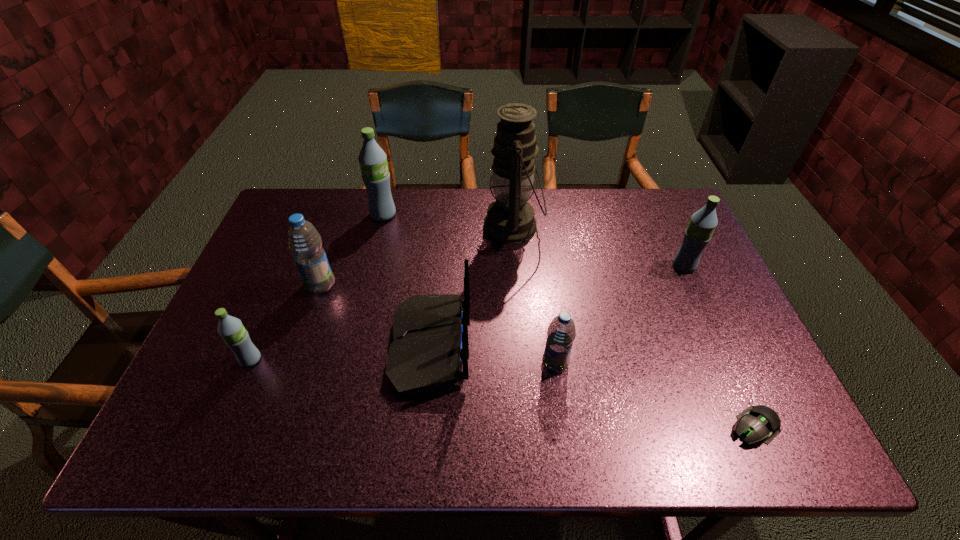
Identify the location of the nearer blue water bottle. This screenshot has height=540, width=960. coord(561,333).

The width and height of the screenshot is (960, 540). I want to click on the leftmost water bottle, so click(231, 329).

You are a GUI agent. You are given a task and a screenshot of the screen. Output one action in this format:
    pyautogui.click(x=<x>, y=<y>)
    Task: Click on the smallest green water bottle
    
    Given the screenshot: What is the action you would take?
    pyautogui.click(x=231, y=329)

Locate an element on the screen. computer mouse is located at coordinates (758, 423).

You are a GUI agent. You are given a task and a screenshot of the screen. Output one action in this format:
    pyautogui.click(x=<x>, y=<y>)
    Task: Click on the nearest object
    
    Given the screenshot: What is the action you would take?
    pyautogui.click(x=758, y=423)

At what (x,y) coordinates should I click in order to perform the action: click on vacant space situated on the right of the tallest object. Please return your answer as a coordinate pair (x, y). Looking at the image, I should click on (602, 226).

Locate an element on the screen. Image resolution: width=960 pixels, height=540 pixels. free space located 0.400m on the right of the farthest green water bottle is located at coordinates (517, 214).

Image resolution: width=960 pixels, height=540 pixels. I want to click on free space located on the front of the farther blue water bottle, so [x=286, y=384].

What are the coordinates of `vacant space situated on the front of the rightmost green water bottle` in the screenshot? It's located at (722, 350).

The width and height of the screenshot is (960, 540). Find the location of `vacant point located on the back of the black router`. vacant point located on the back of the black router is located at coordinates (542, 347).